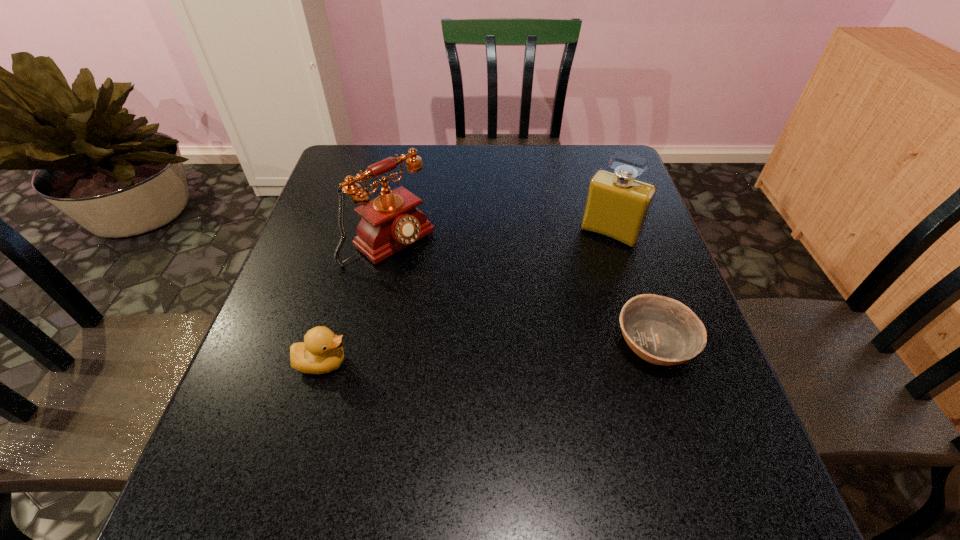
Locate an element on the screen. This screenshot has width=960, height=540. free region located 0.140m on the dial of the telephone is located at coordinates (455, 292).

Locate an element on the screen. Image resolution: width=960 pixels, height=540 pixels. free space located on the dial of the telephone is located at coordinates [461, 297].

Identify the location of duckling located at the left edge. (321, 352).

What are the coordinates of `telephone at the left edge` in the screenshot? It's located at (390, 222).

Locate an element on the screen. bowl present at the right edge is located at coordinates (660, 330).

At what (x,y) coordinates should I click in order to perform the action: click on perfume that is at the right edge. Please return your answer as a coordinate pair (x, y). The width and height of the screenshot is (960, 540). Looking at the image, I should click on (617, 205).

Where is `free location at the far edge`? free location at the far edge is located at coordinates (540, 172).

Find the location of a particular element. The width and height of the screenshot is (960, 540). vacant space at the near edge of the desktop is located at coordinates (324, 430).

The height and width of the screenshot is (540, 960). In the image, there is a desktop. In order to click on vacant space at the left edge in this screenshot , I will do `click(251, 356)`.

Locate an element on the screen. free region at the right edge of the desktop is located at coordinates (646, 229).